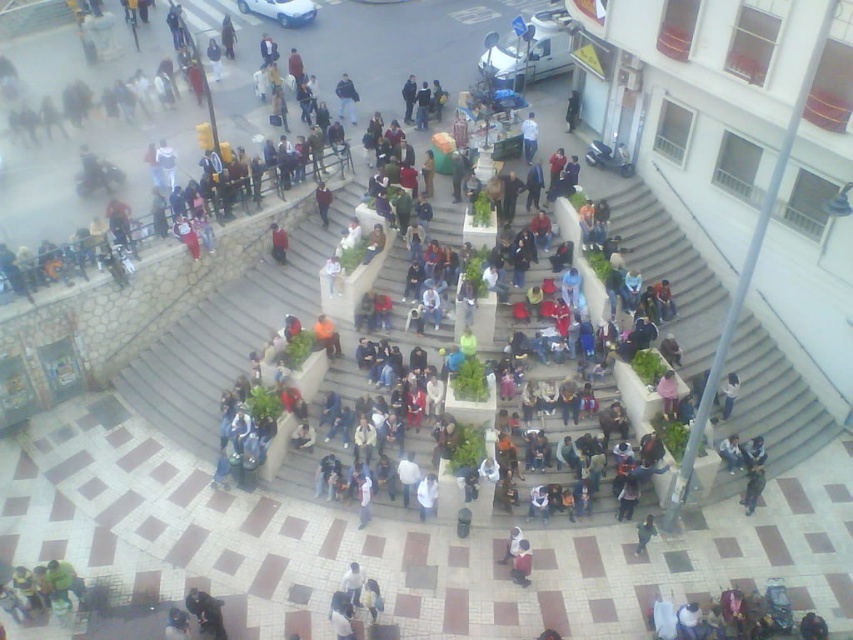
In the scene shown: Can you confirm if white concrete stairs at center is smaller than dark blue sweater at center?

No.

Which is more to the left, white concrete stairs at center or dark blue sweater at center?

dark blue sweater at center is more to the left.

Measure the distance between point (646, 246) and camera.

Point (646, 246) and camera are 24.80 meters apart from each other.

This screenshot has height=640, width=853. I want to click on white concrete stairs at center, so click(x=670, y=272).